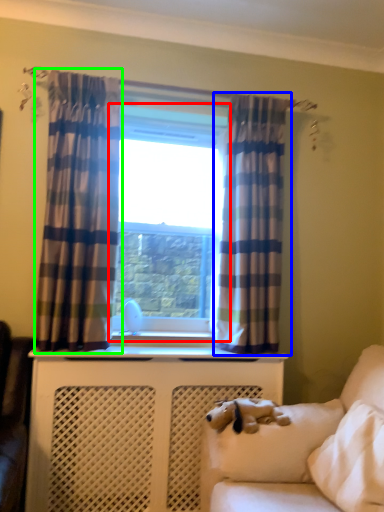
Question: Based on their relative distances, which object is farther from window (highlighted by a red box)? Choose from curtain (highlighted by a blue box) and curtain (highlighted by a green box).

Choices:
 (A) curtain
 (B) curtain

Answer: (B)